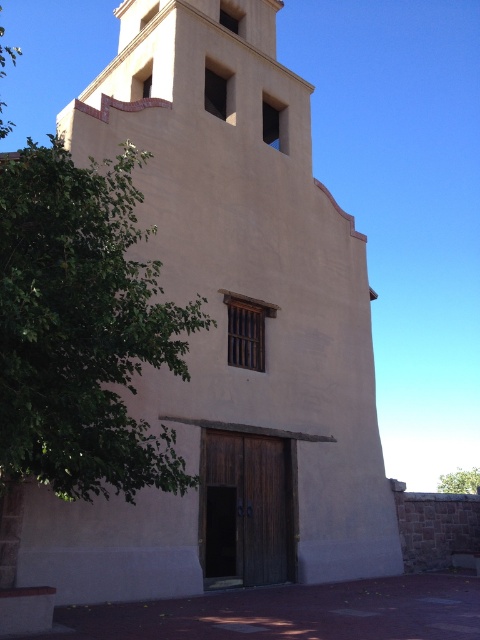
Which is above, green leafy tree at left or green leafy tree at lower right?

green leafy tree at left

Does point (108, 356) come behind point (444, 477)?

That is False.

Find the location of a particular element. The height and width of the screenshot is (640, 480). green leafy tree at left is located at coordinates (82, 328).